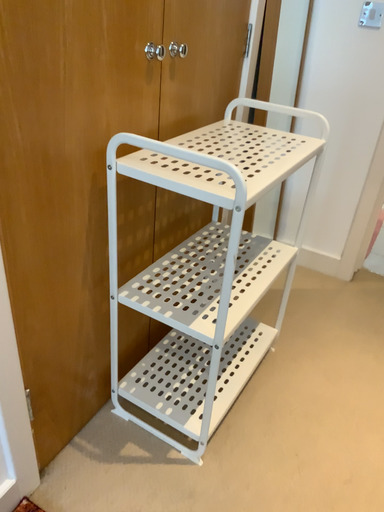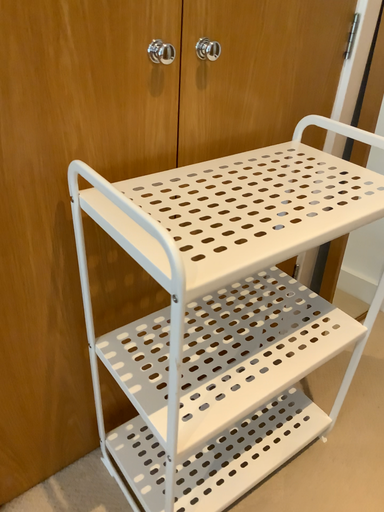
Question: How did the camera likely rotate when shooting the video?

Choices:
 (A) rotated right
 (B) rotated left

Answer: (B)